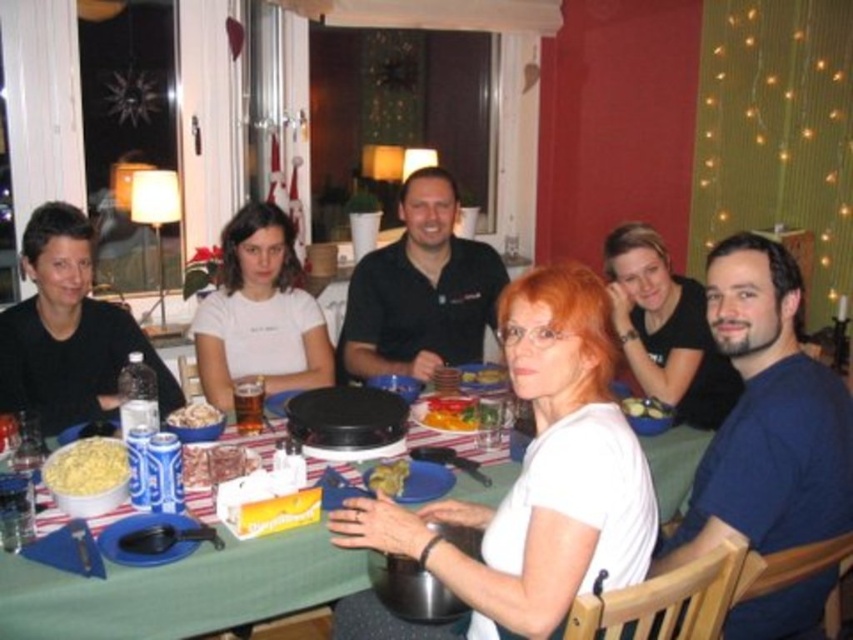
Question: Which object appears closest to the camera in this image?

Choices:
 (A) matte black shirt at upper right
 (B) white cotton shirt at center

Answer: (B)

Question: Is black matte shirt at center closer to the viewer compared to white crumbly pasta at table center?

Choices:
 (A) no
 (B) yes

Answer: (A)

Question: Does white matte shirt at center appear on the right side of dark blue t-shirt at right?

Choices:
 (A) yes
 (B) no

Answer: (B)

Question: Is white matte shirt at center behind matte black shirt at left?

Choices:
 (A) yes
 (B) no

Answer: (B)

Question: Which of the following is the closest to the observer?

Choices:
 (A) black matte shirt at center
 (B) translucent plastic bowl at center
 (C) white matte shirt at center
 (D) yellowish matte food at center

Answer: (C)

Question: Which point is farther to the camera?

Choices:
 (A) (218, 467)
 (B) (384, 296)
 (C) (59, 284)

Answer: (B)